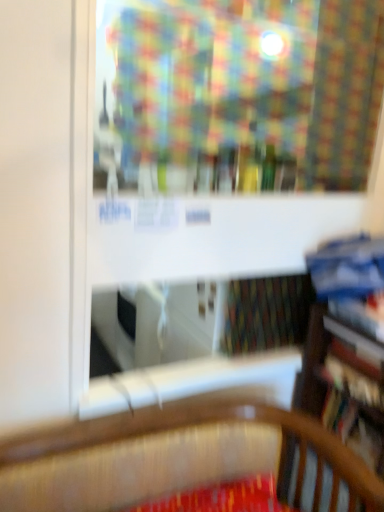
Question: Relative to hardcover book at right, marked as the third book in a top-to-bottom arrangement, is hardcover book at right, which is counted as the third book, starting from the bottom, in front or behind?

Choices:
 (A) behind
 (B) front

Answer: (B)

Question: From a real-world perspective, is hardcover book at right, which is counted as the third book, starting from the bottom, above or below hardcover book at right, the 2th book from the bottom?

Choices:
 (A) below
 (B) above

Answer: (B)

Question: Considering the real-world distances, which object is closest to the hardcover book at right, acting as the 2th book starting from the top?

Choices:
 (A) hardcover book at right, which is counted as the 4th book, starting from the top
 (B) hardcover book at right, marked as the third book in a top-to-bottom arrangement
 (C) blue hardcover book at right, which is counted as the 4th book, starting from the bottom

Answer: (C)

Question: Which object is positioned closest to the blue hardcover book at right, the 1th book from the top?

Choices:
 (A) hardcover book at right, the 2th book from the bottom
 (B) hardcover book at right, which is counted as the 4th book, starting from the top
 (C) hardcover book at right, acting as the 2th book starting from the top

Answer: (C)